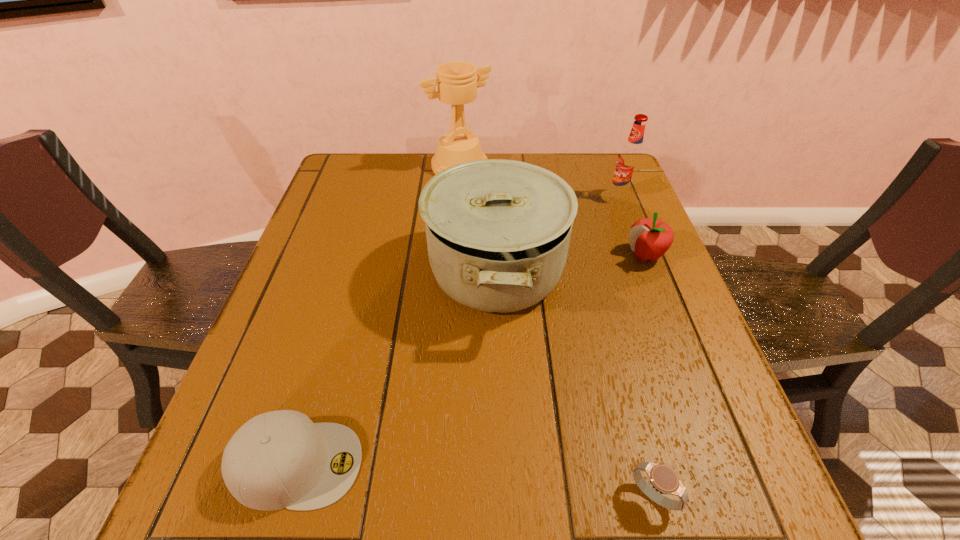
Find the location of a particular element. This screenshot has width=960, height=540. free space located on the left of the root beer is located at coordinates (581, 197).

Image resolution: width=960 pixels, height=540 pixels. I want to click on free space located 0.120m on the front of the saucepan, so click(500, 399).

Identify the location of vacant space located 0.380m on the left of the fourth tallest object. (468, 255).

Where is `vacant space located on the front-facing side of the second shortest object`? This screenshot has height=540, width=960. vacant space located on the front-facing side of the second shortest object is located at coordinates (504, 464).

Where is `vacant space positioned on the left of the shortest object`? This screenshot has height=540, width=960. vacant space positioned on the left of the shortest object is located at coordinates (513, 496).

Identify the location of award present at the far edge. The height and width of the screenshot is (540, 960). (457, 84).

This screenshot has width=960, height=540. Identify the location of root beer located at the far edge. (630, 159).

I want to click on cap situated at the near edge, so click(280, 459).

Locate an element on the screen. Image resolution: width=960 pixels, height=540 pixels. watch that is at the near edge is located at coordinates (663, 478).

Locate an element on the screen. The image size is (960, 540). object located in the left edge section of the desktop is located at coordinates (280, 459).